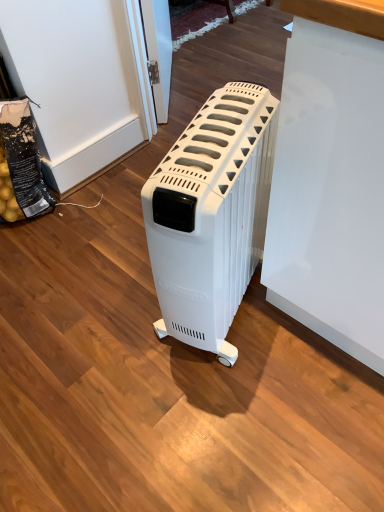
Find the location of a particular element. This screenshot has height=512, width=384. vacant space that is to the left of white plastic heater at center is located at coordinates (110, 317).